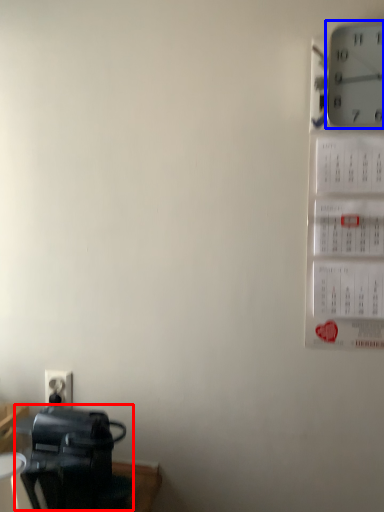
Question: Which of the following is the closest to the observer, appliance (highlighted by a red box) or wall clock (highlighted by a blue box)?

Choices:
 (A) appliance
 (B) wall clock

Answer: (B)